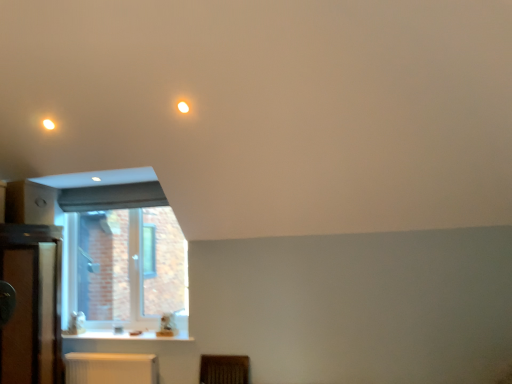
Question: From the image's perspective, is matte white light fixture at upper left, which is counted as the 2th lighting, starting from the right, above or below white plastic radiator at lower center?

Choices:
 (A) below
 (B) above

Answer: (B)

Question: From a real-world perspective, is matte white light fixture at upper left, the 1th lighting when ordered from left to right, above or below white plastic radiator at lower center?

Choices:
 (A) below
 (B) above

Answer: (B)

Question: Estimate the real-world distances between objects in this image. Which object is farther from the matte white light fixture at upper left, the 1th lighting when ordered from left to right?

Choices:
 (A) white plastic radiator at lower center
 (B) wooden dresser at left
 (C) clear glass window at lower left
 (D) white glossy counter top at lower left
 (E) matte white light at upper center, marked as the second lighting in a left-to-right arrangement

Answer: (A)

Question: Based on their relative distances, which object is farther from the matte white light fixture at upper left, the 1th lighting when ordered from left to right?

Choices:
 (A) white glossy counter top at lower left
 (B) matte white light at upper center, marked as the second lighting in a left-to-right arrangement
 (C) wooden dresser at left
 (D) white plastic radiator at lower center
 (E) clear glass window at lower left

Answer: (D)